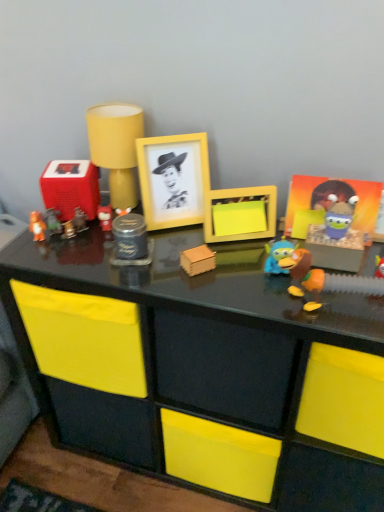
Locate an element on the screen. The height and width of the screenshot is (512, 384). vacant area located to the right-hand side of matte brown figurine at left, acting as the eleventh toy starting from the right is located at coordinates (109, 244).